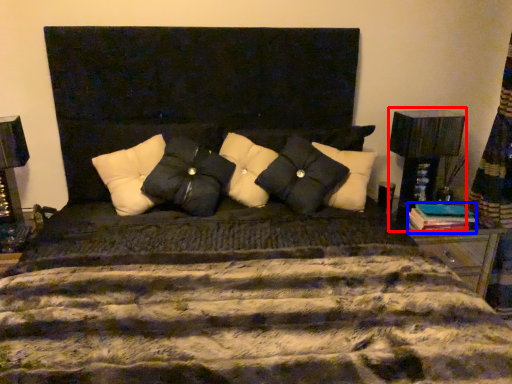
Question: Which of the following is the closest to the observer, table lamp (highlighted by a red box) or book (highlighted by a blue box)?

Choices:
 (A) table lamp
 (B) book

Answer: (B)